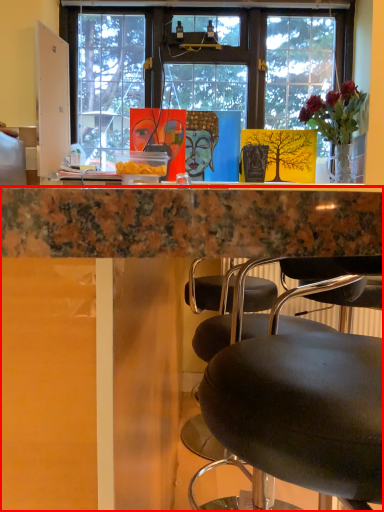
Question: From the image's perspective, where is desk (annotated by the red box) located relative to houseplant?

Choices:
 (A) above
 (B) below

Answer: (B)